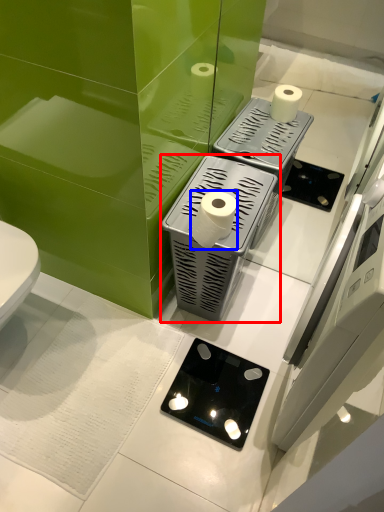
Question: Which object appears farthest to the camera in this image, appliance (highlighted by a red box) or toilet paper (highlighted by a blue box)?

Choices:
 (A) appliance
 (B) toilet paper

Answer: (A)